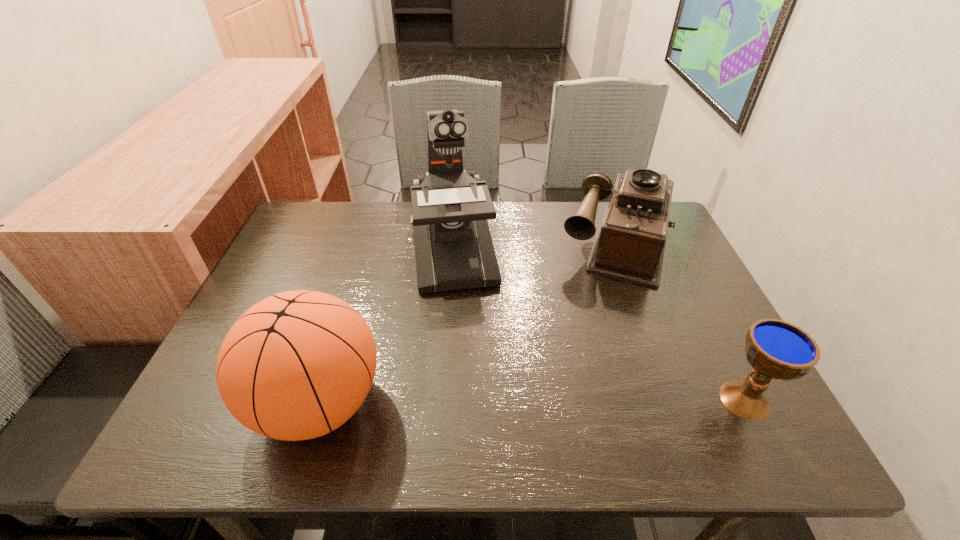
Identify the location of the second tallest object. (297, 365).

Find the location of a particular element. Image resolution: width=960 pixels, height=540 pixels. chalice is located at coordinates (776, 349).

Locate an element on the screen. This screenshot has width=960, height=540. phonograph_record is located at coordinates (630, 242).

Where is `microscope`? microscope is located at coordinates (454, 250).

Locate an element on the screen. This screenshot has height=540, width=960. free space located on the back of the basketball is located at coordinates (369, 239).

The image size is (960, 540). I want to click on vacant area situated on the back of the chalice, so point(697,307).

The height and width of the screenshot is (540, 960). Find the location of `free space located on the horn of the phonograph_record`. free space located on the horn of the phonograph_record is located at coordinates (585, 373).

Locate an element on the screen. Image resolution: width=960 pixels, height=540 pixels. vacant region located 0.260m on the horn of the phonograph_record is located at coordinates (588, 362).

Locate an element on the screen. This screenshot has height=540, width=960. free space located 0.160m on the horn of the phonograph_record is located at coordinates (596, 329).

At what (x,y) coordinates should I click in order to perform the action: click on vacant region located through the eyepieces of the microscope. Please return your answer as a coordinate pair (x, y). Image resolution: width=960 pixels, height=540 pixels. Looking at the image, I should click on (x=464, y=331).